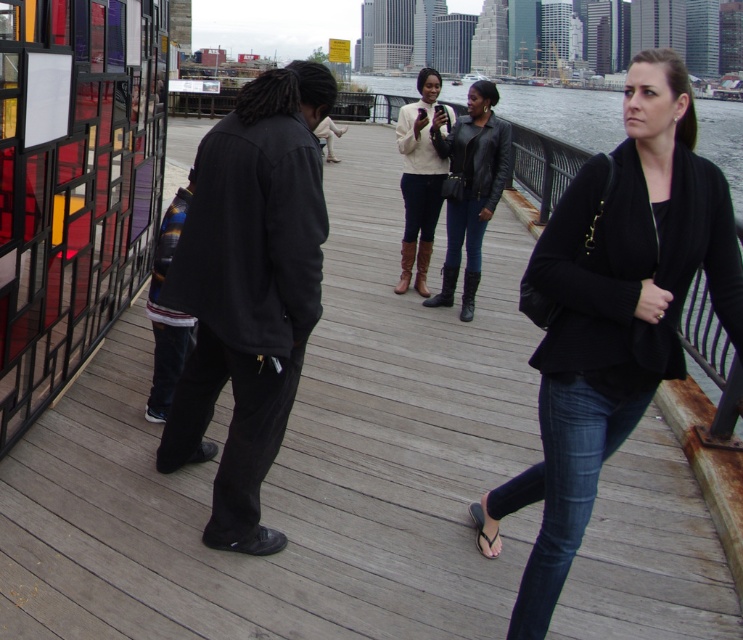
You are a photographer standing at the edge of the wooden pier. You need to capture a photo of both the black matte jacket at center and the leather jacket at center in the same frame. Given that your camera has a maximum focus range of 5 meters, will you be able to include both subjects in a single focused shot?

The distance between the black matte jacket at center and the leather jacket at center is 5.46 meters. Since the camera can only focus up to 5 meters, the subjects are too far apart to be in the same focused shot.